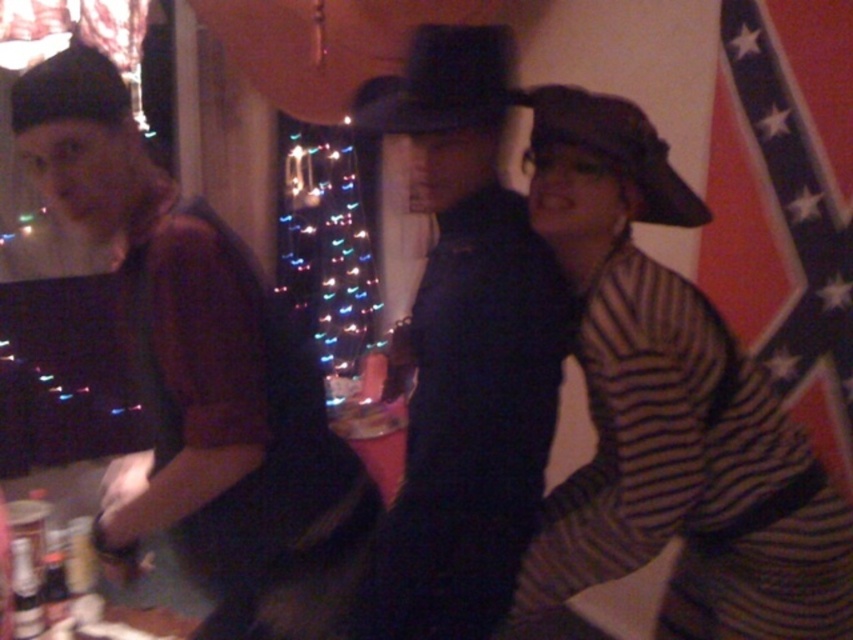
You are standing in the room and want to take a photo of the matte black shirt at left. Where should you position yourself to capture it in the frame?

The matte black shirt at left is located at point (199, 372), so you should position yourself facing the left side of the image to capture it in the frame.

You are at a party and want to place a small decorative item on the table between the red and white striped flag at right and the metallic can at center. Which object should you place it closer to so it doesn not block the view of the shorter object?

You should place the decorative item closer to the metallic can at center because the red and white striped flag at right is taller than the metallic can at center, so placing it near the shorter metallic can at center will avoid blocking its view.